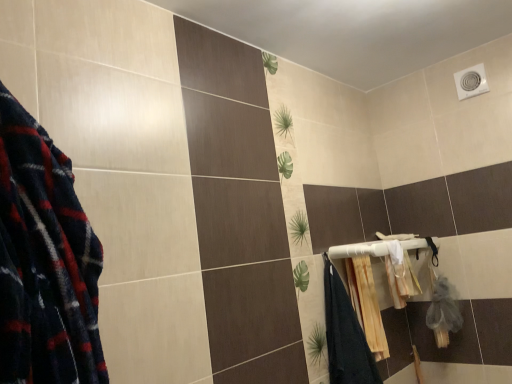
Question: Does white plastic towel bar at upper right have a lesser height compared to white fabric bath towel at lower right, which is counted as the 1th bath towel, starting from the right?

Choices:
 (A) no
 (B) yes

Answer: (B)

Question: From a real-world perspective, is white plastic towel bar at upper right physically below white fabric bath towel at lower right, placed as the 2th bath towel when sorted from left to right?

Choices:
 (A) yes
 (B) no

Answer: (B)

Question: Does white plastic towel bar at upper right turn towards white fabric bath towel at lower right, which is counted as the 1th bath towel, starting from the right?

Choices:
 (A) yes
 (B) no

Answer: (B)

Question: Would you say white plastic towel bar at upper right contains white fabric bath towel at lower right, placed as the 2th bath towel when sorted from left to right?

Choices:
 (A) no
 (B) yes

Answer: (A)

Question: Is white plastic towel bar at upper right outside of white fabric bath towel at lower right, placed as the 2th bath towel when sorted from left to right?

Choices:
 (A) no
 (B) yes

Answer: (B)

Question: Does white plastic towel bar at upper right have a larger size compared to white fabric bath towel at lower right, which is counted as the 1th bath towel, starting from the right?

Choices:
 (A) no
 (B) yes

Answer: (B)

Question: Can you confirm if white plastic towel bar at upper right is positioned to the left of beige textured towel at lower right, acting as the first bath towel starting from the left?

Choices:
 (A) yes
 (B) no

Answer: (B)

Question: Is white plastic towel bar at upper right facing away from beige textured towel at lower right, acting as the first bath towel starting from the left?

Choices:
 (A) no
 (B) yes

Answer: (A)

Question: Is white plastic towel bar at upper right aimed at beige textured towel at lower right, which is the second bath towel in right-to-left order?

Choices:
 (A) yes
 (B) no

Answer: (B)

Question: Can we say white plastic towel bar at upper right lies outside beige textured towel at lower right, acting as the first bath towel starting from the left?

Choices:
 (A) no
 (B) yes

Answer: (B)

Question: Is beige textured towel at lower right, which is the second bath towel in right-to-left order, located within white plastic towel bar at upper right?

Choices:
 (A) yes
 (B) no

Answer: (B)

Question: Is the position of white plastic towel bar at upper right less distant than that of beige textured towel at lower right, which is the second bath towel in right-to-left order?

Choices:
 (A) no
 (B) yes

Answer: (B)

Question: Is white plastic towel bar at upper right at the back of beige textured towel at lower right, which is the second bath towel in right-to-left order?

Choices:
 (A) no
 (B) yes

Answer: (A)